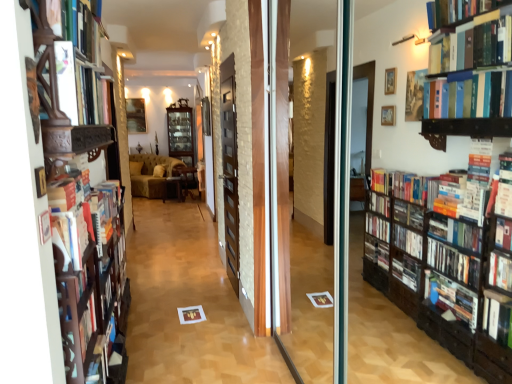
At what (x,y) coordinates should I click in order to perform the action: click on vacant space to the right of wooden bookshelf at left. Please return your answer as a coordinate pair (x, y). Looking at the image, I should click on (178, 372).